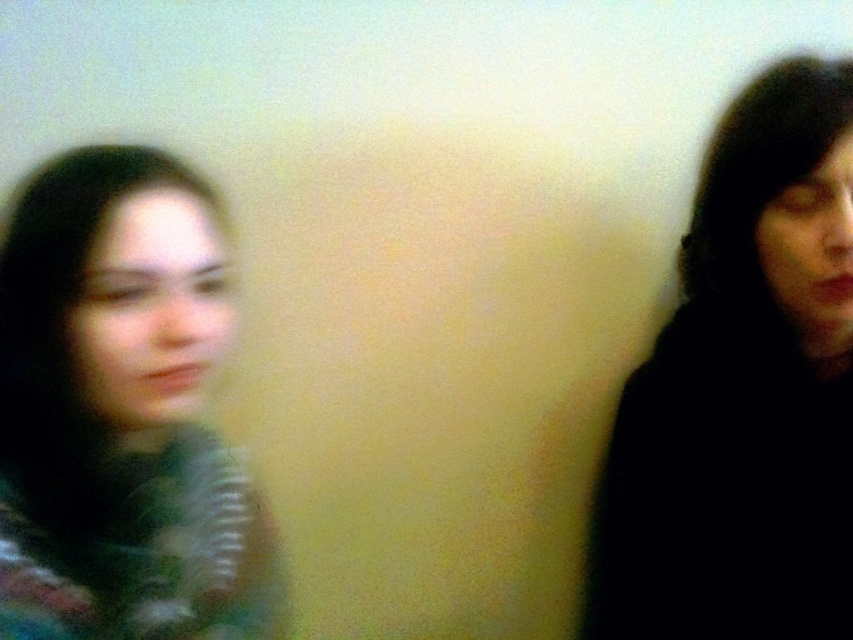
Question: Can you confirm if black matte hair at right is positioned above matte green sweater at left?

Choices:
 (A) yes
 (B) no

Answer: (A)

Question: Which point is farther to the camera?

Choices:
 (A) (751, 332)
 (B) (209, 259)

Answer: (A)

Question: Which object appears closest to the camera in this image?

Choices:
 (A) matte green sweater at left
 (B) black matte hair at right

Answer: (A)

Question: Which of the following is the closest to the observer?

Choices:
 (A) (151, 378)
 (B) (619, 540)

Answer: (A)

Question: Can you confirm if black matte hair at right is thinner than matte green sweater at left?

Choices:
 (A) yes
 (B) no

Answer: (B)

Question: Does black matte hair at right have a lesser width compared to matte green sweater at left?

Choices:
 (A) yes
 (B) no

Answer: (B)